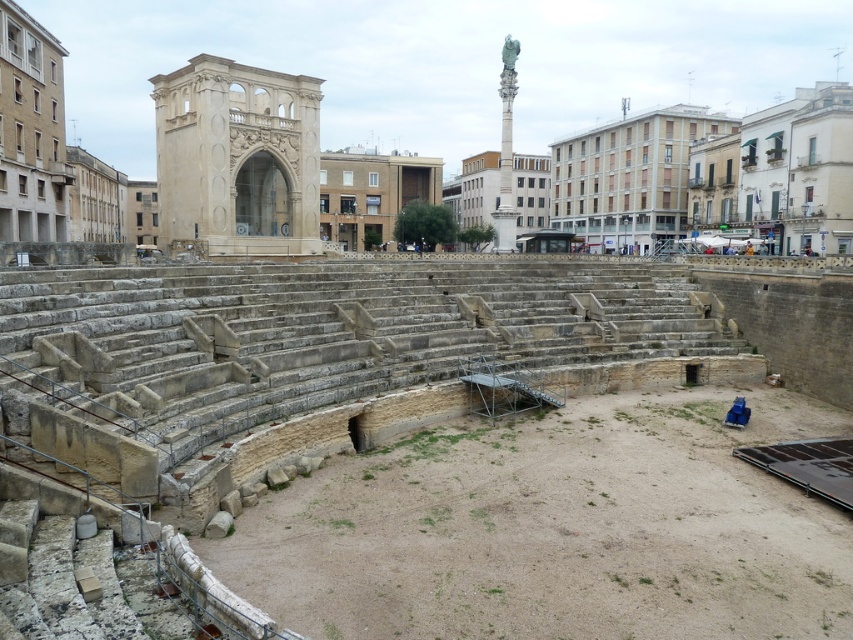
You are an architect visiting the ancient amphitheater and notice the beige stone arch at center and the green marble column at upper center. Which object is located more to the left in the image?

The beige stone arch at center is positioned more to the left than the green marble column at upper center.

You are an architect visiting the amphitheater and want to take a photo of the beige stone arch at center without the green marble column at upper center appearing in the background. Is this possible based on their positions?

The beige stone arch at center is in front of the green marble column at upper center, so you can position yourself so that the arch blocks the column from view, making it possible to take a photo without the column appearing in the background.